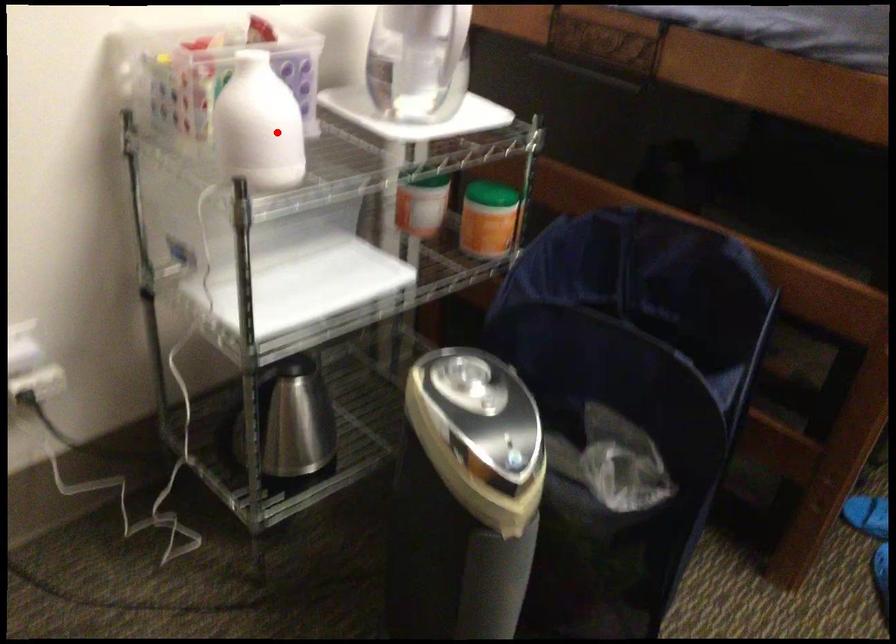
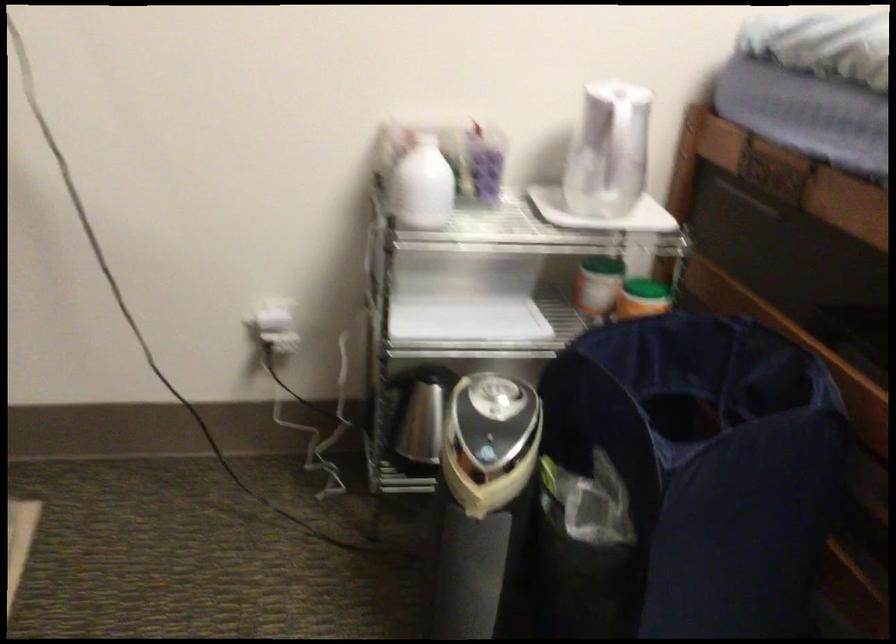
The point at the highlighted location is marked in the first image. Where is the corresponding point in the second image?

(421, 185)